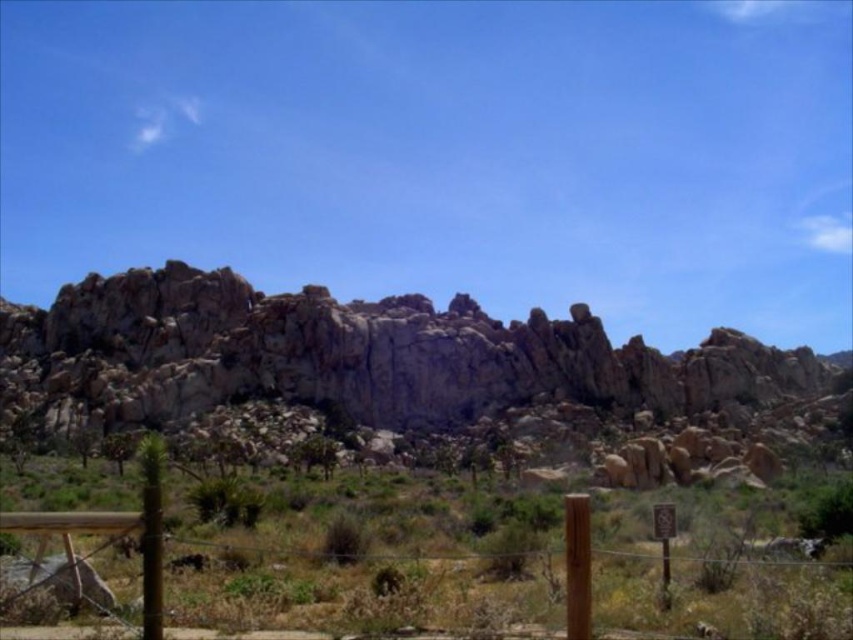
Question: Which point is farther to the camera?

Choices:
 (A) rocky gray mountain at center
 (B) brown wooden fence at lower center

Answer: (A)

Question: Is rocky gray mountain at center further to camera compared to brown wooden fence at lower center?

Choices:
 (A) yes
 (B) no

Answer: (A)

Question: Is rocky gray mountain at center to the left of brown wooden fence at lower center from the viewer's perspective?

Choices:
 (A) yes
 (B) no

Answer: (B)

Question: Is rocky gray mountain at center to the left of brown wooden fence at lower center from the viewer's perspective?

Choices:
 (A) yes
 (B) no

Answer: (B)

Question: Which point is closer to the camera?

Choices:
 (A) brown wooden fence at lower center
 (B) rocky gray mountain at center

Answer: (A)